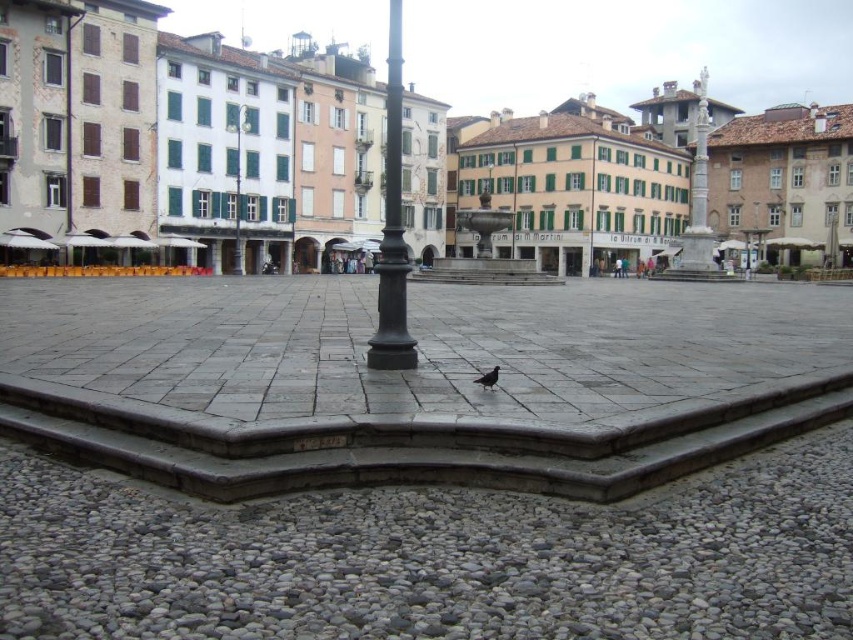
How distant is green glass lamp post at upper center from brown matte bird at lower center?

A distance of 55.77 meters exists between green glass lamp post at upper center and brown matte bird at lower center.

Is green glass lamp post at upper center thinner than brown matte bird at lower center?

Incorrect, green glass lamp post at upper center's width is not less than brown matte bird at lower center's.

Is point (234, 253) closer to viewer compared to point (497, 365)?

No, (234, 253) is further to viewer.

Locate an element on the screen. The width and height of the screenshot is (853, 640). green glass lamp post at upper center is located at coordinates (238, 186).

Identify the location of black metal pole at upper left. This screenshot has height=640, width=853. (68, 124).

Is black metal pole at upper left below brown matte bird at lower center?

Incorrect, black metal pole at upper left is not positioned below brown matte bird at lower center.

Is point (80, 19) farther from camera compared to point (480, 381)?

That is True.

In order to click on black metal pole at upper left in this screenshot , I will do `click(68, 124)`.

Is black metal pole at center to the right of black metal pole at upper left from the viewer's perspective?

Indeed, black metal pole at center is positioned on the right side of black metal pole at upper left.

Where is `black metal pole at center`? This screenshot has height=640, width=853. black metal pole at center is located at coordinates (392, 227).